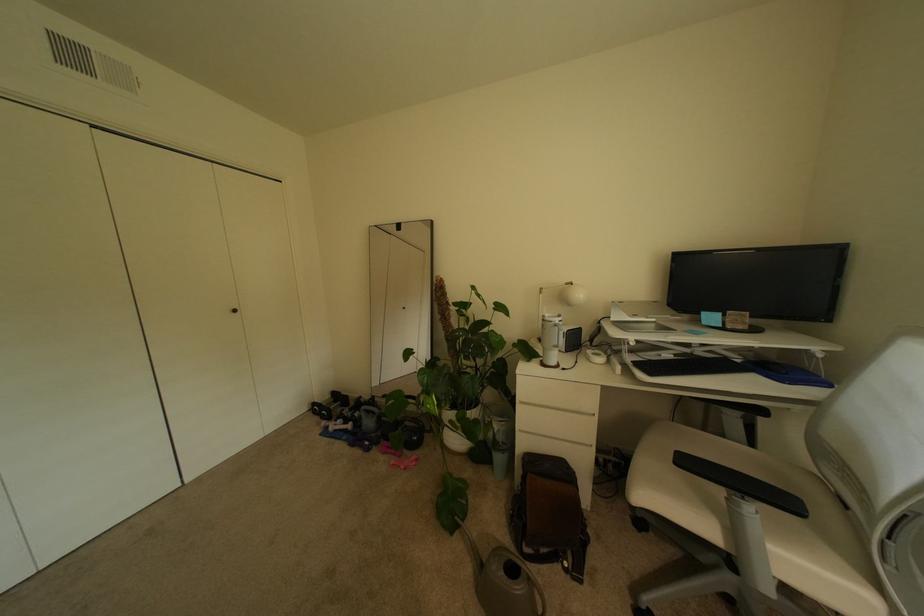
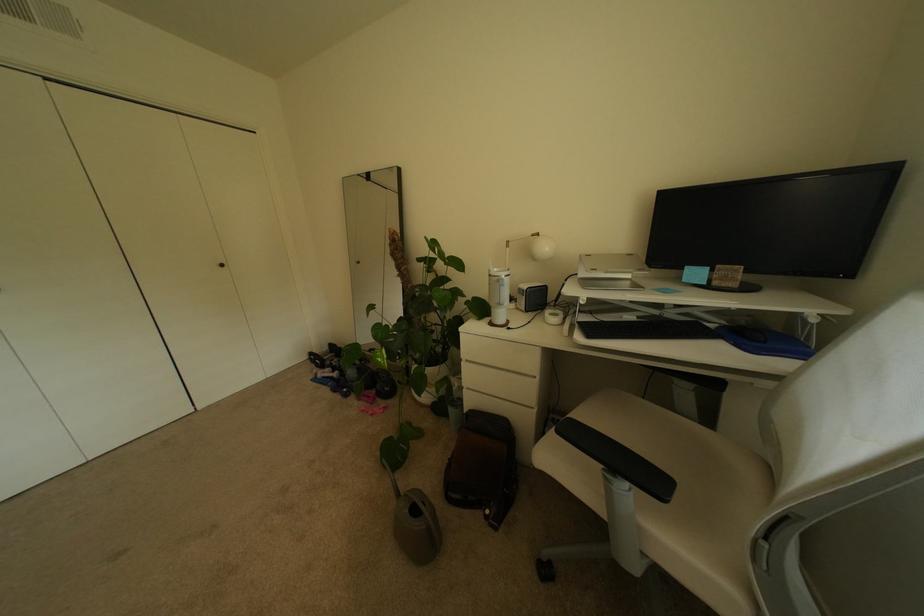
Locate, in the second image, the point that corresponds to pixel 661 326 in the first image.

(637, 284)